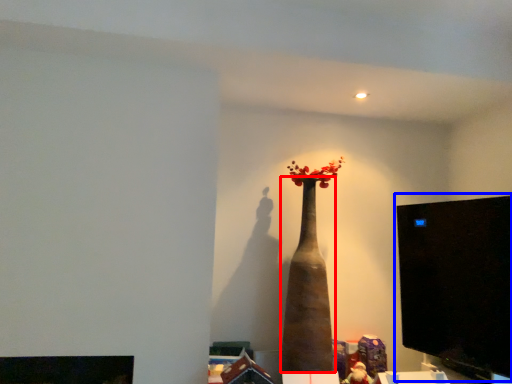
Question: Among these objects, which one is farthest to the camera, vase (highlighted by a red box) or computer monitor (highlighted by a blue box)?

Choices:
 (A) vase
 (B) computer monitor

Answer: (A)